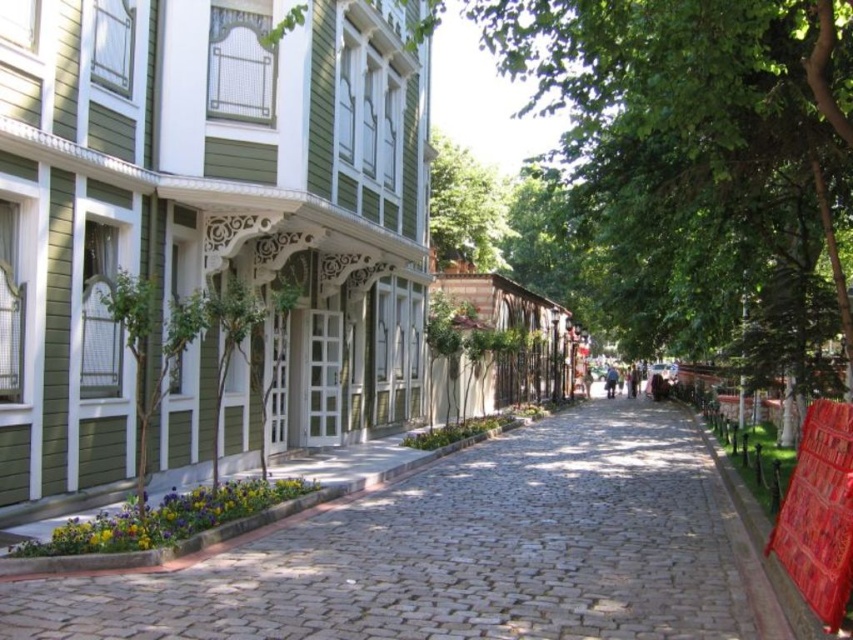
You are walking along the cobblestone street and want to find a spot to sit under the shade of the green leafy tree at upper center. Is the cobblestone pavement at center a good place to sit?

Yes, the cobblestone pavement at center is located below the green leafy tree at upper center, so it would provide shade from the tree.